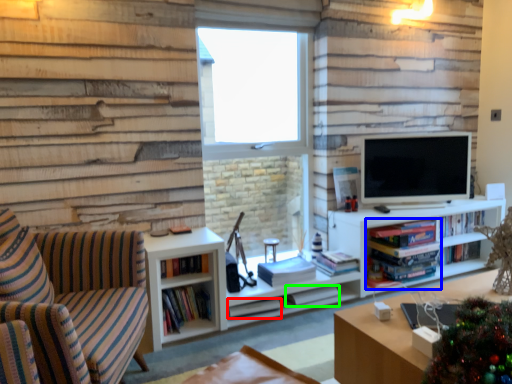
Question: Estimate the real-world distances between objects in this image. Which object is closer to book (highlighted by a red box), book (highlighted by a blue box) or book (highlighted by a green box)?

Choices:
 (A) book
 (B) book

Answer: (B)